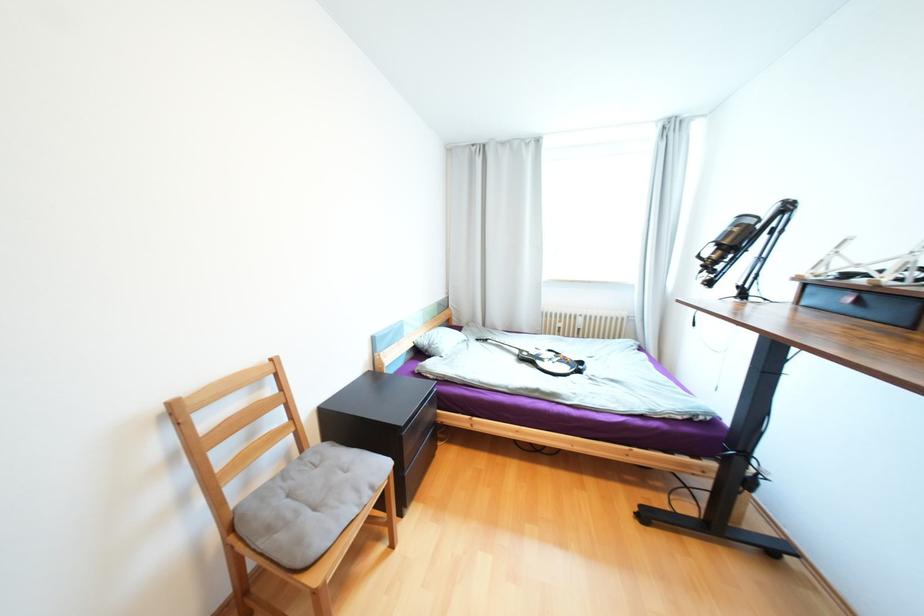
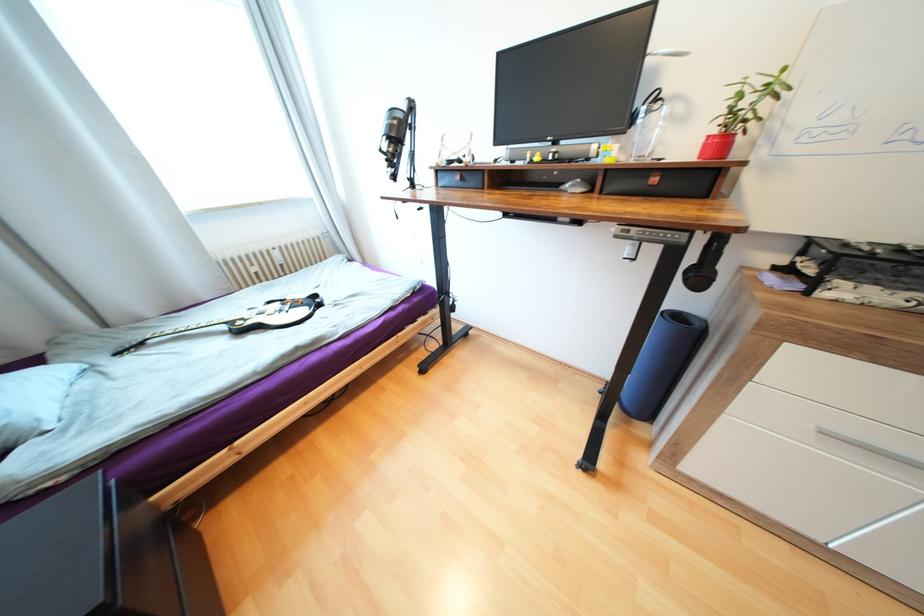
Where in the second image is the point corresponding to [523,352] from the first image?

(229, 328)